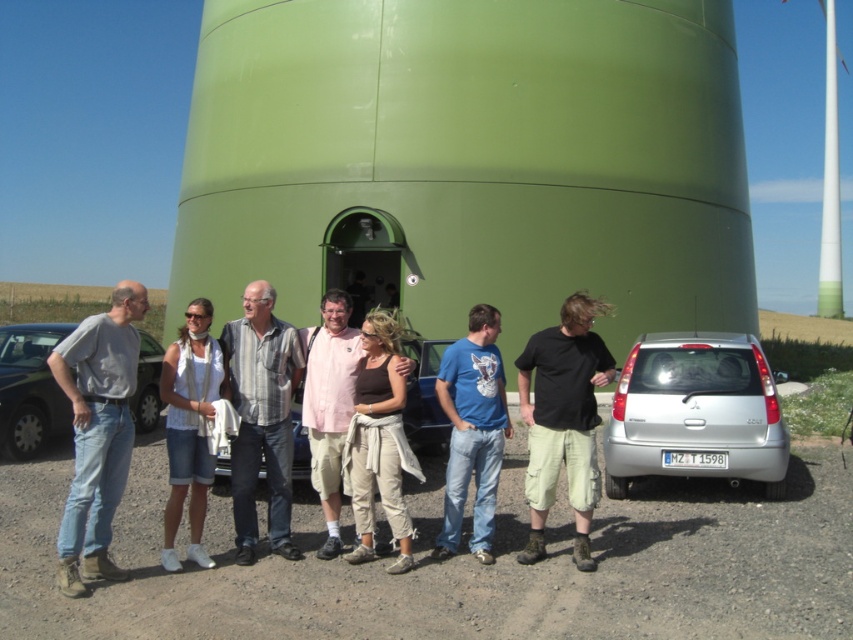
Question: Which object is farther from the camera taking this photo?

Choices:
 (A) striped shirt at center
 (B) blue cotton t-shirt at center
 (C) dark brown leather pants at center
 (D) silver metallic hatchback at lower right

Answer: (D)

Question: Is gray cotton shirt at left positioned before denim shorts at center?

Choices:
 (A) yes
 (B) no

Answer: (A)

Question: Considering the real-world distances, which object is farthest from the blue cotton t-shirt at center?

Choices:
 (A) silver metallic hatchback at lower right
 (B) denim shorts at center

Answer: (A)

Question: Is silver metallic hatchback at lower right closer to the viewer compared to denim shorts at center?

Choices:
 (A) yes
 (B) no

Answer: (B)

Question: Which object appears closest to the camera in this image?

Choices:
 (A) metallic blue sedan at center
 (B) dark brown leather pants at center

Answer: (B)

Question: Does silver metallic hatchback at lower right have a smaller size compared to striped shirt at center?

Choices:
 (A) yes
 (B) no

Answer: (B)